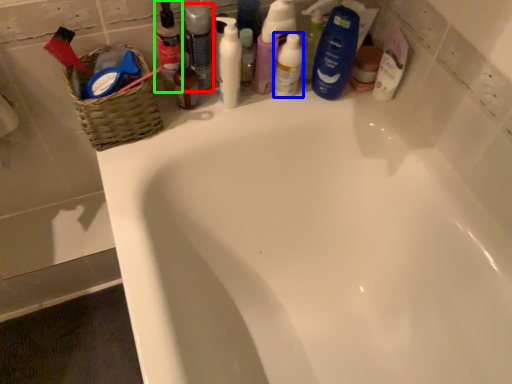
Question: Which object is positioned farthest from toiletry (highlighted by a red box)? Select from mouthwash (highlighted by a blue box) and toiletry (highlighted by a green box).

Choices:
 (A) mouthwash
 (B) toiletry

Answer: (A)